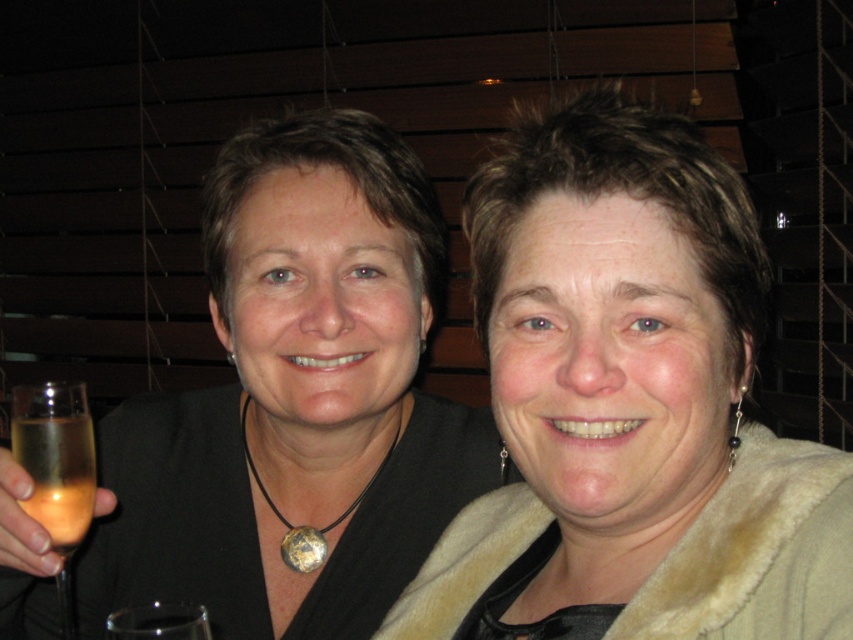
I want to click on fuzzy beige coat at center, so click(x=630, y=406).

Is the position of fuzzy beige coat at center less distant than that of matte black top at center?

Yes, it is.

This screenshot has width=853, height=640. I want to click on fuzzy beige coat at center, so click(630, 406).

You are a GUI agent. You are given a task and a screenshot of the screen. Output one action in this format:
    pyautogui.click(x=<x>, y=<y>)
    Task: Click on the fuzzy beige coat at center
    The width and height of the screenshot is (853, 640).
    Given the screenshot: What is the action you would take?
    pyautogui.click(x=630, y=406)

Which is in front, point (6, 600) or point (38, 496)?

Point (38, 496)

Who is higher up, matte black top at center or translucent glass at left?

matte black top at center is above.

Measure the distance between point (200, 595) and camera.

32.19 inches

At what (x,y) coordinates should I click in order to perform the action: click on matte black top at center. Please return your answer as a coordinate pair (x, y). Image resolution: width=853 pixels, height=640 pixels. Looking at the image, I should click on (296, 401).

Who is positioned more to the left, fuzzy beige coat at center or translucent glass at left?

translucent glass at left is more to the left.

From the picture: Can you confirm if fuzzy beige coat at center is bigger than translucent glass at left?

Correct, fuzzy beige coat at center is larger in size than translucent glass at left.

Which is behind, point (509, 388) or point (85, 483)?

Positioned behind is point (85, 483).

This screenshot has width=853, height=640. I want to click on fuzzy beige coat at center, so click(630, 406).